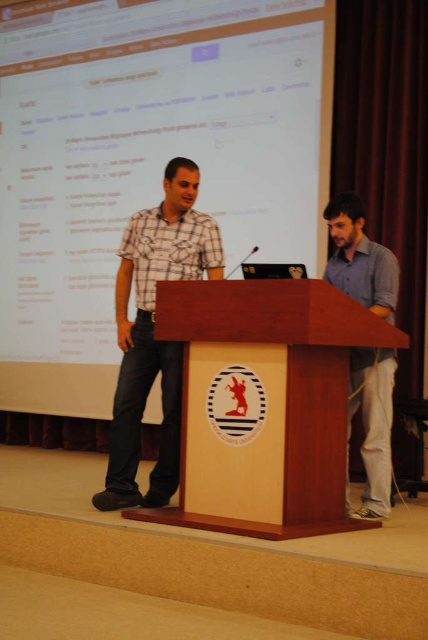
Who is shorter, wooden podium at center or gray cotton shirt at right?

With less height is wooden podium at center.

Is point (261, 396) positioned in front of point (382, 394)?

Yes, it is.

Locate an element on the screen. wooden podium at center is located at coordinates (264, 403).

Is matte white screen at upper center above gray cotton shirt at right?

Indeed, matte white screen at upper center is positioned over gray cotton shirt at right.

Who is shorter, matte white screen at upper center or gray cotton shirt at right?

gray cotton shirt at right

Does point (231, 29) come closer to viewer compared to point (385, 509)?

No, it is not.

Identify the location of matte white screen at upper center. (145, 161).

Between plaid shirt at center and matte black screen at center, which one is positioned higher?

matte black screen at center is above.

Can you confirm if plaid shirt at center is smaller than matte black screen at center?

No.

Does point (133, 392) come farther from viewer compared to point (273, 264)?

Yes, point (133, 392) is farther from viewer.

Where is `plaid shirt at center`? This screenshot has height=640, width=428. plaid shirt at center is located at coordinates (152, 333).